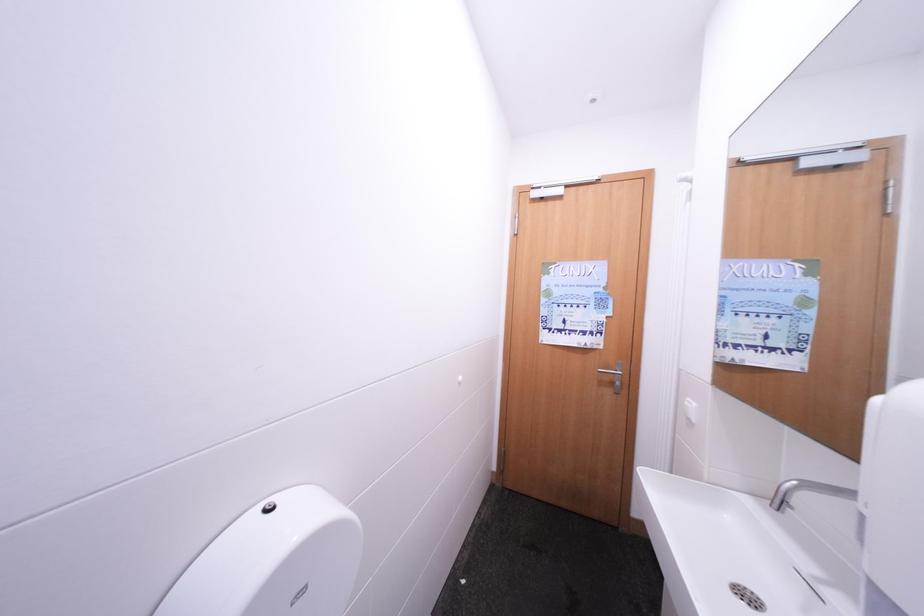
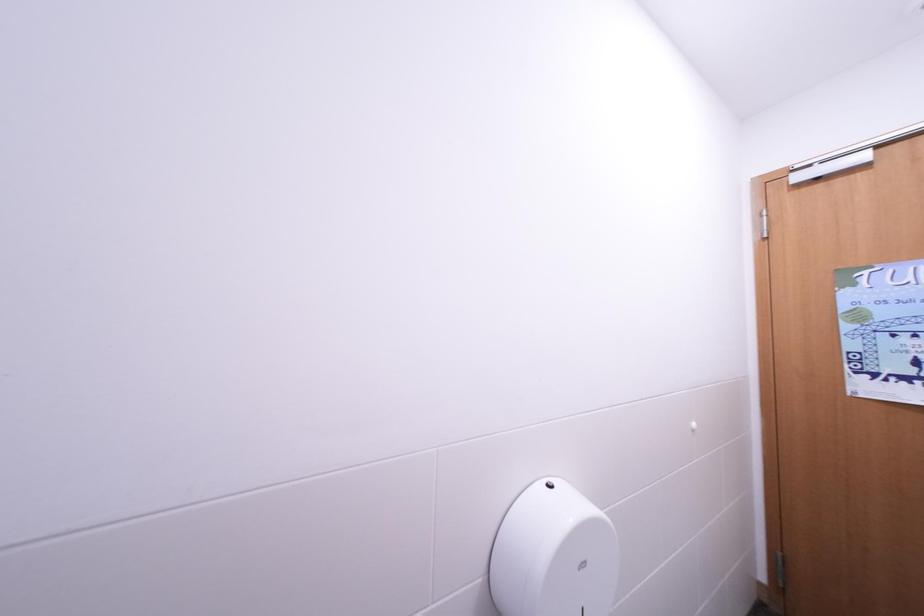
Question: The images are taken continuously from a first-person perspective. In which direction is your viewpoint rotating?

Choices:
 (A) Left
 (B) Right
 (C) Up
 (D) Down

Answer: (A)